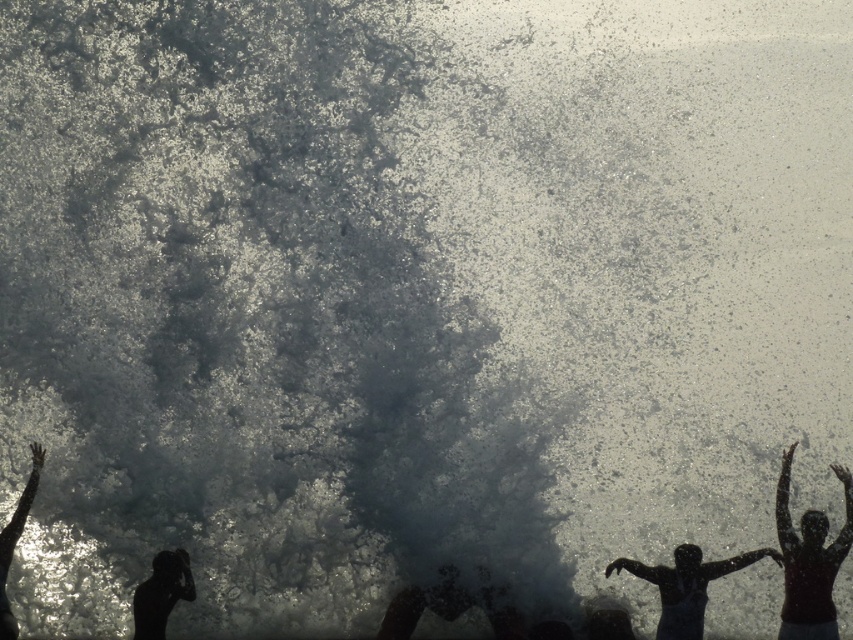
Question: Among these points, which one is nearest to the camera?

Choices:
 (A) 0,632
 (B) 178,586
 (C) 693,632
 (D) 849,493

Answer: (A)

Question: Does silhouette human at lower right appear on the right side of black matte person at lower left?

Choices:
 (A) yes
 (B) no

Answer: (A)

Question: Which object is farther from the camera taking this photo?

Choices:
 (A) silhouette human at lower right
 (B) silhouette human at left
 (C) silhouette human at right
 (D) black matte person at lower left

Answer: (A)

Question: Does silhouette human at right have a greater width compared to silhouette human at left?

Choices:
 (A) no
 (B) yes

Answer: (B)

Question: In this image, where is silhouette human at lower right located relative to black matte person at lower left?

Choices:
 (A) above
 (B) below

Answer: (B)

Question: Which object appears farthest from the camera in this image?

Choices:
 (A) silhouette human at left
 (B) black matte person at lower left

Answer: (B)